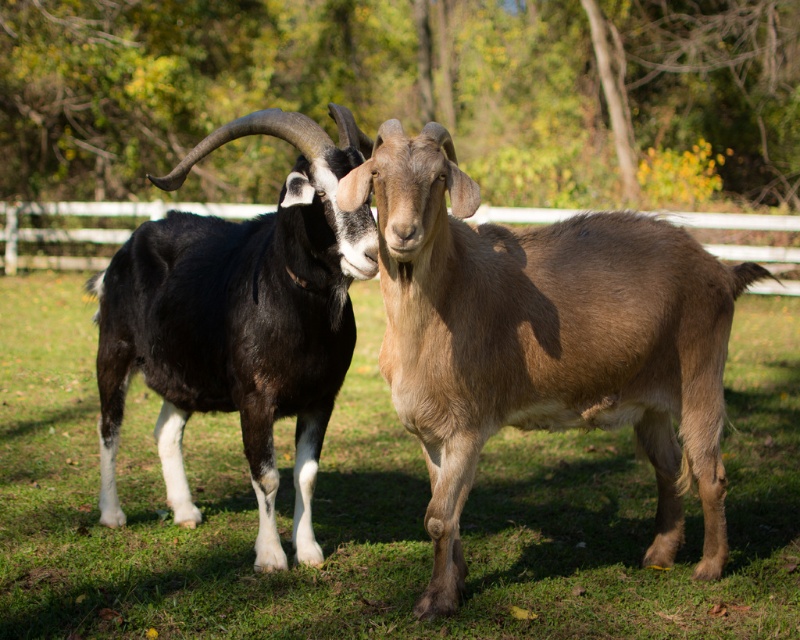
Locate an element on the screen. The width and height of the screenshot is (800, 640). green grass at center is located at coordinates (377, 508).

Is point (370, 467) closer to camera compared to point (288, 196)?

That is False.

Is point (476, 628) more distant than point (182, 328)?

No, it is in front of (182, 328).

You are a GUI agent. You are given a task and a screenshot of the screen. Output one action in this format:
    pyautogui.click(x=<x>, y=<y>)
    Task: Click on the green grass at center
    
    Given the screenshot: What is the action you would take?
    [377, 508]

Does green grass at center lie behind brown woolen goat at center?

Yes, it is.

Who is positioned more to the right, green grass at center or brown woolen goat at center?

brown woolen goat at center

Which is behind, point (500, 563) or point (692, 307)?

The point (500, 563) is more distant.

I want to click on green grass at center, so click(x=377, y=508).

Does point (420, 429) come farther from viewer compared to point (256, 436)?

No, (420, 429) is in front of (256, 436).

This screenshot has height=640, width=800. What are the coordinates of `brown woolen goat at center` in the screenshot? It's located at (544, 340).